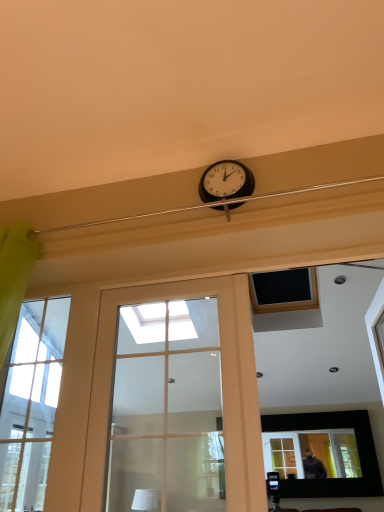
Question: Is clear glass window at left to the right of matte black picture frame at upper center from the viewer's perspective?

Choices:
 (A) no
 (B) yes

Answer: (A)

Question: Does clear glass window at left come in front of matte black picture frame at upper center?

Choices:
 (A) yes
 (B) no

Answer: (A)

Question: Does clear glass window at left have a greater width compared to matte black picture frame at upper center?

Choices:
 (A) no
 (B) yes

Answer: (B)

Question: From a real-world perspective, is clear glass window at left physically below matte black picture frame at upper center?

Choices:
 (A) no
 (B) yes

Answer: (A)

Question: Is clear glass window at left located outside matte black picture frame at upper center?

Choices:
 (A) yes
 (B) no

Answer: (A)

Question: From the image's perspective, is clear glass window at left above matte black picture frame at upper center?

Choices:
 (A) no
 (B) yes

Answer: (B)

Question: Is black plastic clock at upper center positioned beyond the bounds of white matte lampshade at upper center?

Choices:
 (A) yes
 (B) no

Answer: (A)

Question: Considering the relative sizes of black plastic clock at upper center and white matte lampshade at upper center in the image provided, is black plastic clock at upper center wider than white matte lampshade at upper center?

Choices:
 (A) no
 (B) yes

Answer: (A)

Question: Are black plastic clock at upper center and white matte lampshade at upper center far apart?

Choices:
 (A) no
 (B) yes

Answer: (B)

Question: Is black plastic clock at upper center turned away from white matte lampshade at upper center?

Choices:
 (A) no
 (B) yes

Answer: (A)

Question: From the image's perspective, would you say black plastic clock at upper center is shown under white matte lampshade at upper center?

Choices:
 (A) no
 (B) yes

Answer: (A)

Question: Could you tell me if black plastic clock at upper center is turned towards white matte lampshade at upper center?

Choices:
 (A) yes
 (B) no

Answer: (B)

Question: Is matte black picture frame at upper center at the right side of matte glass door at center?

Choices:
 (A) no
 (B) yes

Answer: (B)